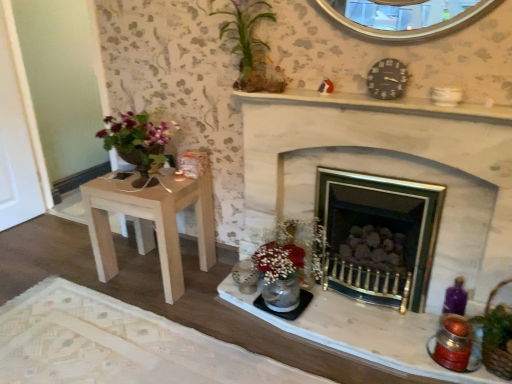
Identify the location of vacant space to the left of shiny metallic candle holder at lower right, acting as the first candle holder starting from the right. (399, 342).